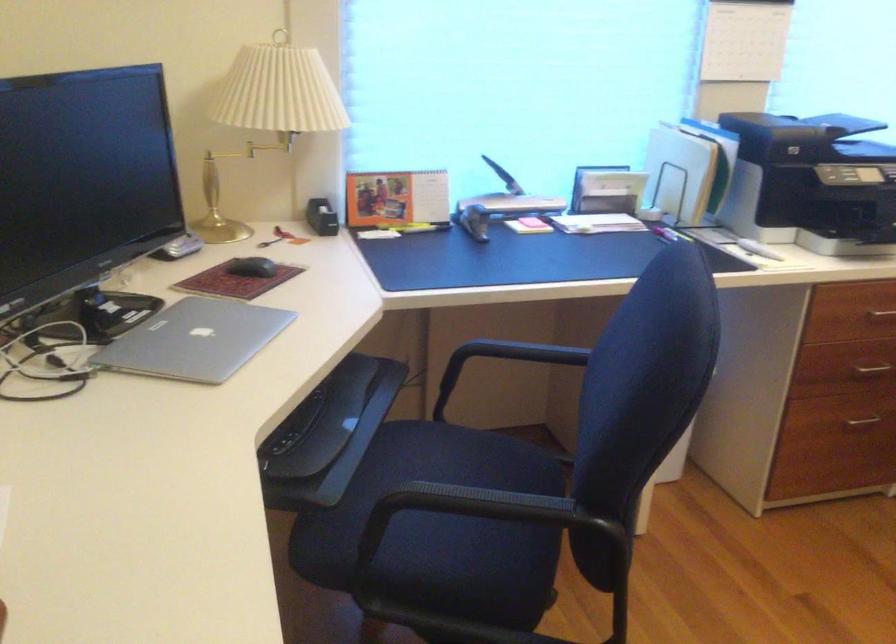
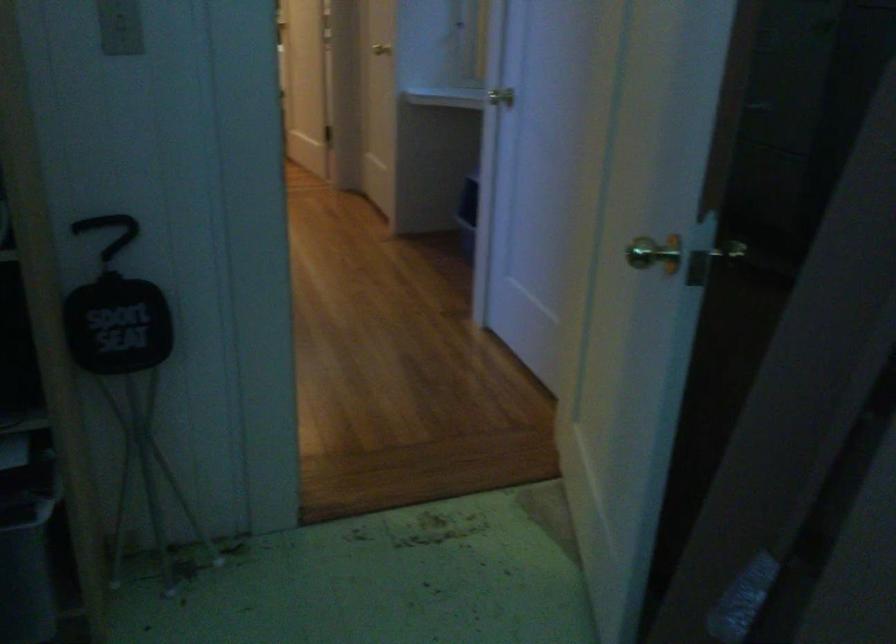
Question: I am providing you with two images of the same scene from different viewpoints. Which of the following objects are not visible in image2?

Choices:
 (A) silver drawer handle
 (B) chair sitting surface
 (C) seat handle
 (D) bee-shaped magnet

Answer: (A)